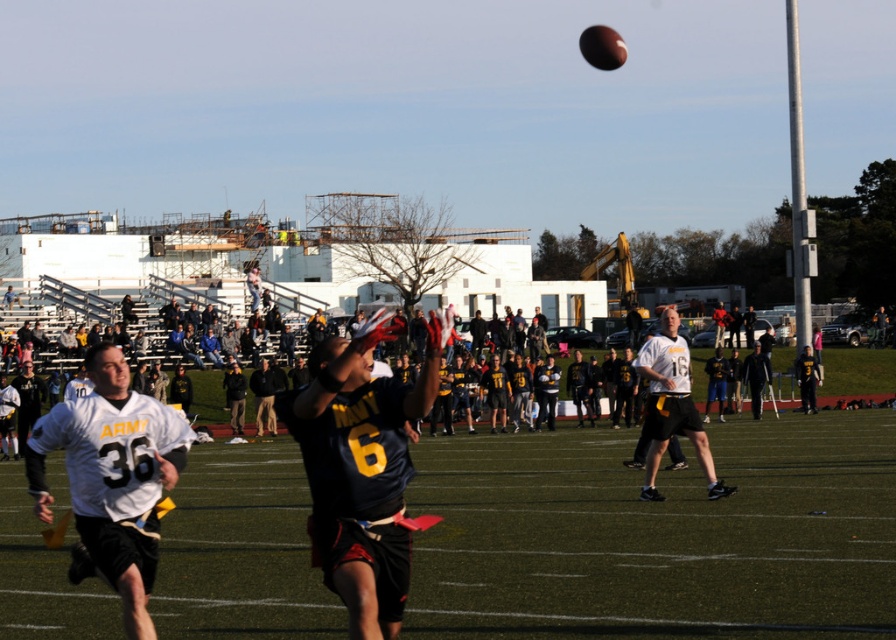
You are a photographer trying to capture the perfect shot of the flag football game. You notice two points marked in the image at coordinates point (362, 371) and point (112, 374). Which point is nearer to your camera lens?

Point (362, 371) is closer to the camera than point (112, 374).

Consider the image. You are a referee watching the game. You need to determine if the two players, the dark blue jersey at center and the white jersey at center, are positioned side by side. Based on their positions, can you confirm if they are next to each other horizontally?

The dark blue jersey at center is positioned on the right side of white jersey at center, meaning they are next to each other horizontally.

You are a spectator at the flag football game. You notice two points in the image, one at coordinates point (309, 445) and the other at point (649, 488). Which point is nearer to you?

Point (309, 445) is closer to the viewer than point (649, 488).